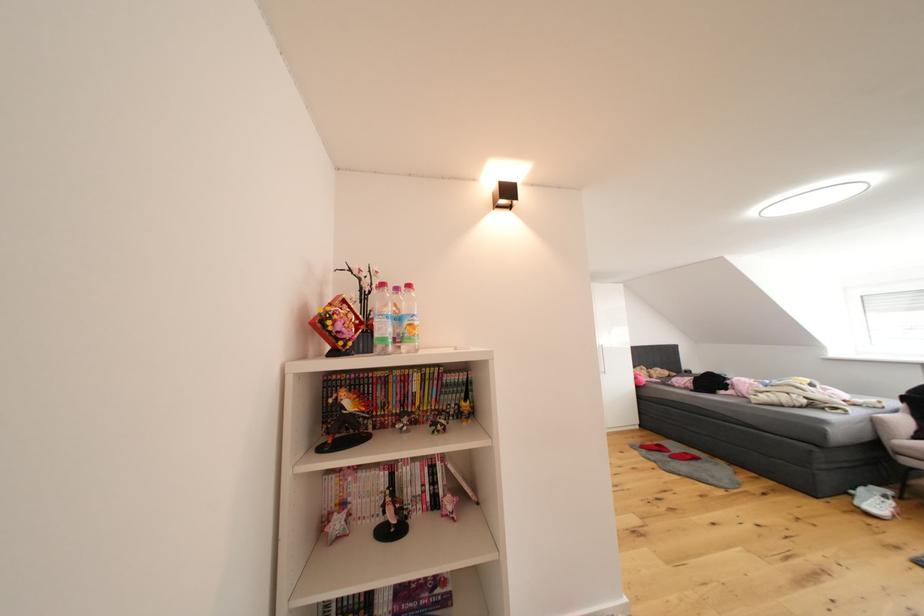
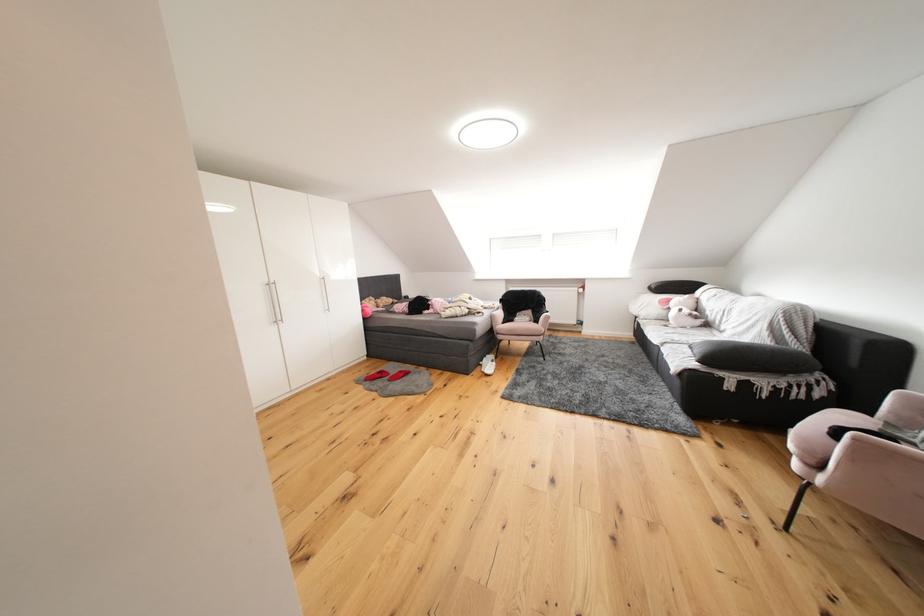
The point at (647, 445) is marked in the first image. Where is the corresponding point in the second image?

(372, 377)